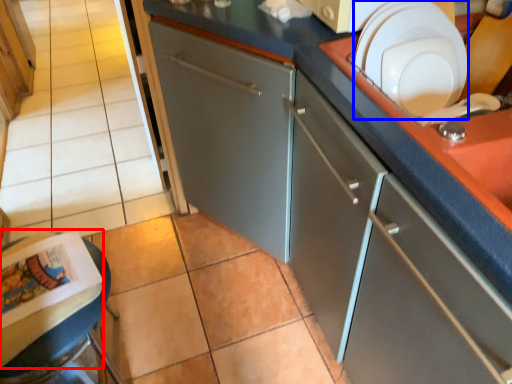
Question: Which of the following is the farthest to the observer, magazine (highlighted by a red box) or tableware (highlighted by a blue box)?

Choices:
 (A) magazine
 (B) tableware

Answer: (A)